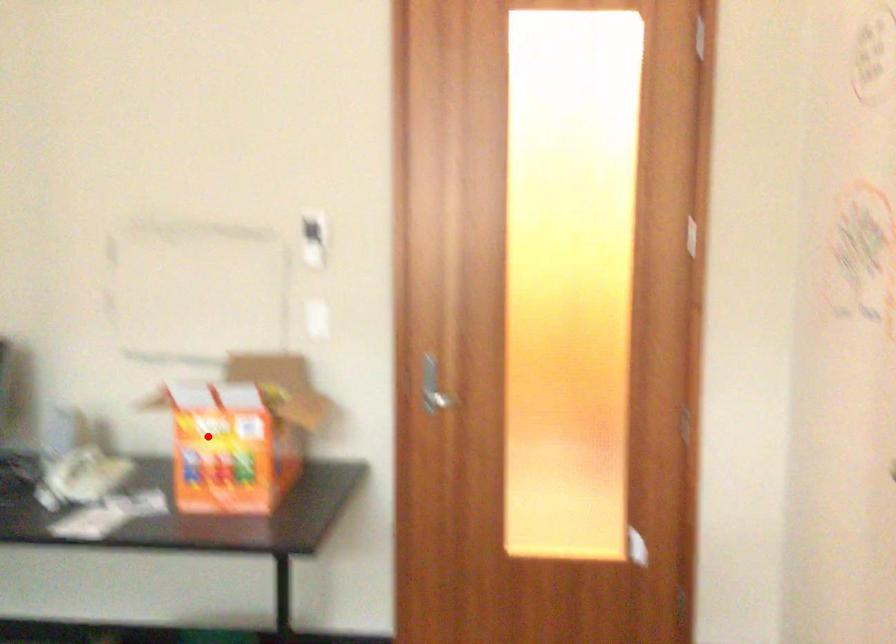
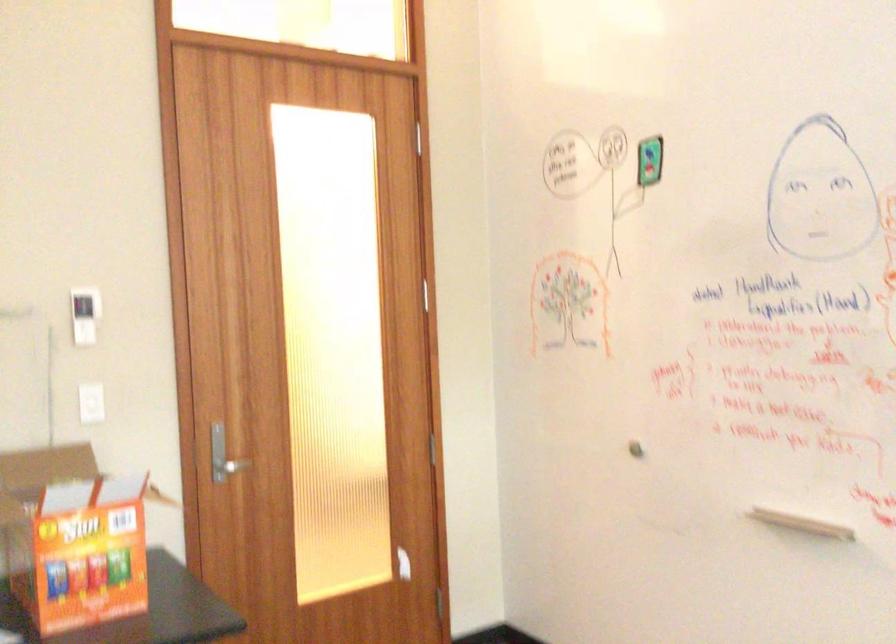
In the second image, find the point that corresponds to the highlighted location in the first image.

(72, 538)